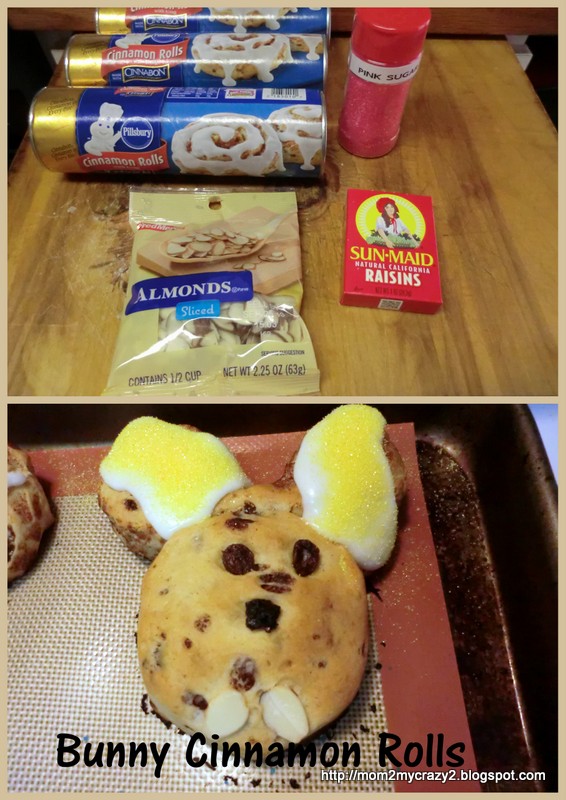
Identify the location of cookie sheet. The image size is (566, 800). tap(484, 450).